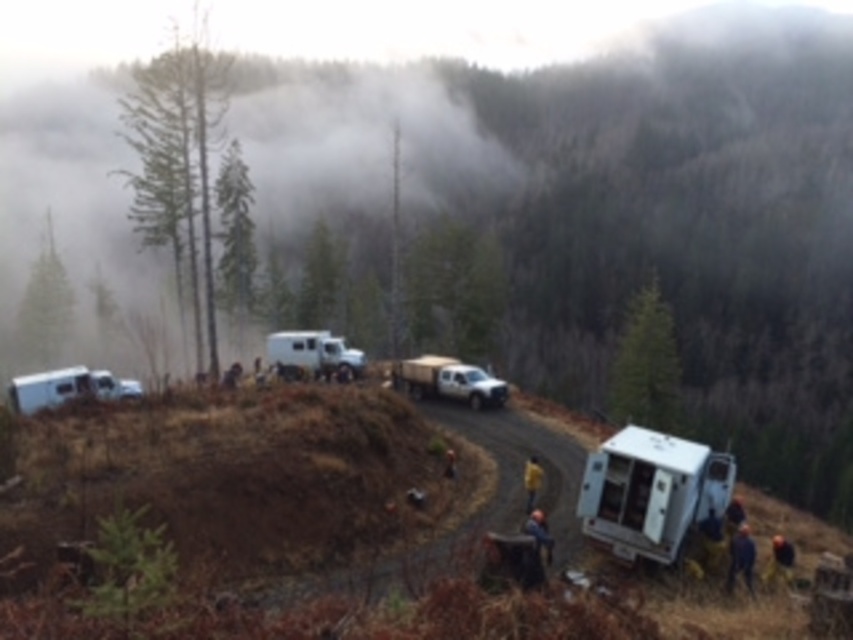
You are standing at the edge of the dirt road in the forest scene. You see the white matte camper van at center and the dark brown leather jacket at center. If you want to walk from the van to the jacket, how far will you have to walk?

The white matte camper van at center and dark brown leather jacket at center are 21.11 meters apart from each other, so you will have to walk 21.11 meters to get from the van to the jacket.

You are a hiker who wants to know if the white matte recreational vehicle at lower left can fit through a narrow path that is the same height as the yellow hard hat at center. Can it pass through?

The white matte recreational vehicle at lower left is taller than the yellow hard hat at center, so it cannot pass through the narrow path which has a height limit matching the yellow hard hat at center.